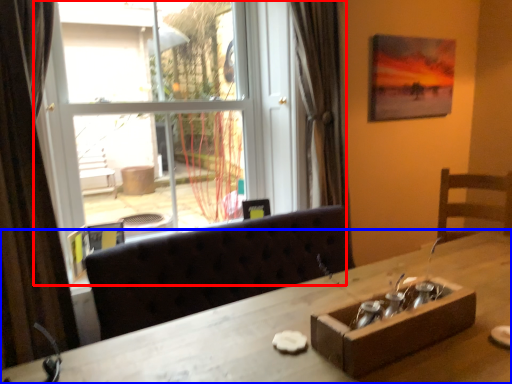
Question: Among these objects, which one is nearest to the camera, window (highlighted by a red box) or desk (highlighted by a blue box)?

Choices:
 (A) window
 (B) desk

Answer: (B)